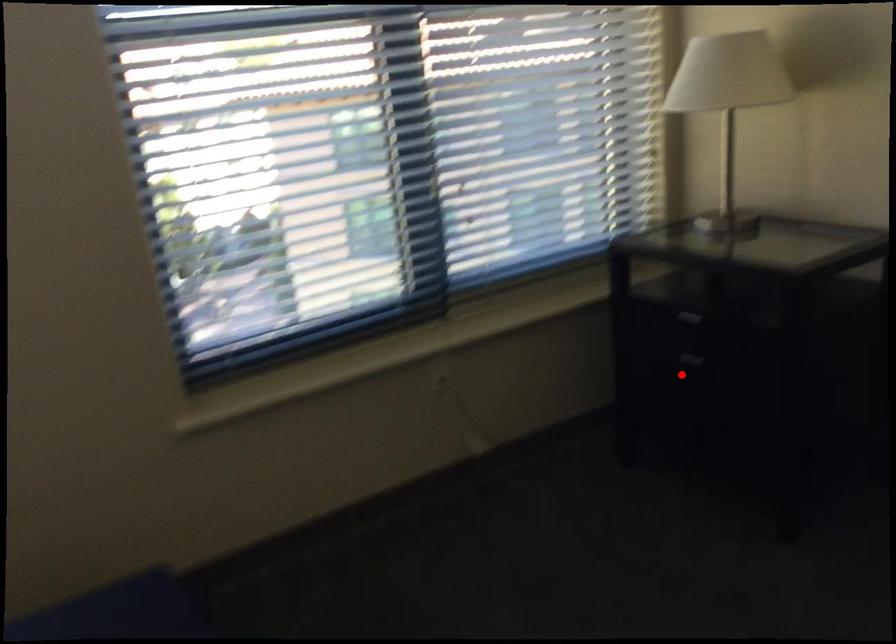
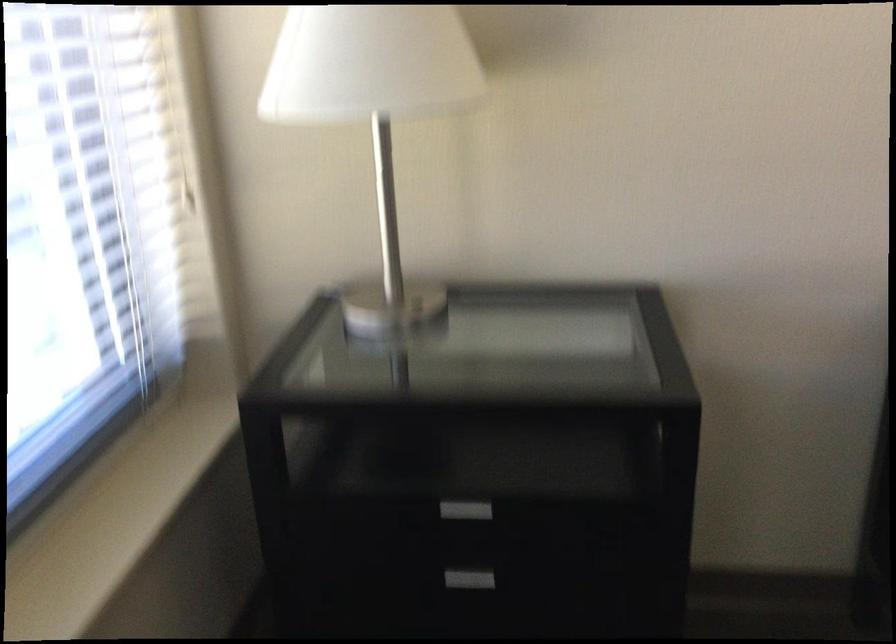
Locate, in the second image, the point that corresponds to the highlighted location in the first image.

(476, 569)